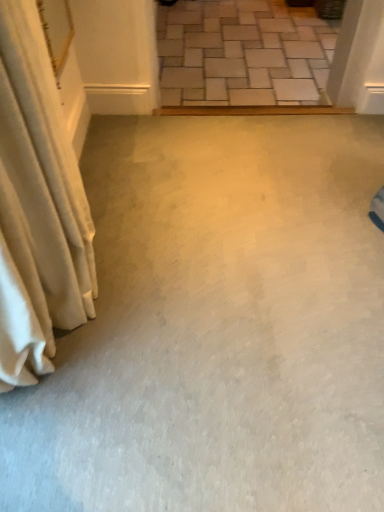
What do you see at coordinates (243, 53) in the screenshot?
I see `light gray stone steps at upper center` at bounding box center [243, 53].

You are a GUI agent. You are given a task and a screenshot of the screen. Output one action in this format:
    pyautogui.click(x=<x>, y=<y>)
    Task: Click on the light gray stone steps at upper center
    The width and height of the screenshot is (384, 512).
    Given the screenshot: What is the action you would take?
    pos(243,53)

Find the location of `white fabric curtain at left`. white fabric curtain at left is located at coordinates (37, 207).

Measure the distance between point (34, 5) and camera.

The distance of point (34, 5) from camera is 1.13 meters.

The image size is (384, 512). Describe the element at coordinates (37, 207) in the screenshot. I see `white fabric curtain at left` at that location.

You are a GUI agent. You are given a task and a screenshot of the screen. Output one action in this format:
    pyautogui.click(x=<x>, y=<y>)
    Task: Click on the light gray stone steps at upper center
    
    Given the screenshot: What is the action you would take?
    pyautogui.click(x=243, y=53)

Does white fabric curtain at left appear on the left side of light gray stone steps at upper center?

Indeed, white fabric curtain at left is positioned on the left side of light gray stone steps at upper center.

Considering the relative positions of white fabric curtain at left and light gray stone steps at upper center in the image provided, is white fabric curtain at left in front of light gray stone steps at upper center?

Yes.

Considering the points (14, 134) and (216, 1), which point is behind, point (14, 134) or point (216, 1)?

The point (216, 1) is behind.

From the image's perspective, which object appears higher, white fabric curtain at left or light gray stone steps at upper center?

light gray stone steps at upper center appears higher in the image.

From a real-world perspective, is white fabric curtain at left physically above light gray stone steps at upper center?

Indeed, from a real-world perspective, white fabric curtain at left stands above light gray stone steps at upper center.

Considering the sizes of white fabric curtain at left and light gray stone steps at upper center in the image, is white fabric curtain at left wider or thinner than light gray stone steps at upper center?

Considering their sizes, white fabric curtain at left looks slimmer than light gray stone steps at upper center.

Between white fabric curtain at left and light gray stone steps at upper center, which one has more height?

white fabric curtain at left is taller.

Who is bigger, white fabric curtain at left or light gray stone steps at upper center?

Bigger between the two is light gray stone steps at upper center.

Can we say white fabric curtain at left lies outside light gray stone steps at upper center?

That's correct, white fabric curtain at left is outside of light gray stone steps at upper center.

Are white fabric curtain at left and light gray stone steps at upper center making contact?

No, white fabric curtain at left is not next to light gray stone steps at upper center.

Is white fabric curtain at left facing towards light gray stone steps at upper center?

No, white fabric curtain at left is not aimed at light gray stone steps at upper center.

How far apart are white fabric curtain at left and light gray stone steps at upper center?

The distance of white fabric curtain at left from light gray stone steps at upper center is 2.51 meters.

Find the location of a particular element. concrete behind the white fabric curtain at left is located at coordinates (243, 53).

From the picture: Considering the positions of objects light gray stone steps at upper center and white fabric curtain at left in the image provided, who is more to the left, light gray stone steps at upper center or white fabric curtain at left?

white fabric curtain at left.

Is light gray stone steps at upper center positioned before white fabric curtain at left?

No.

Does point (250, 69) appear closer or farther from the camera than point (34, 47)?

Point (250, 69) is farther from the camera than point (34, 47).

From the image's perspective, does light gray stone steps at upper center appear lower than white fabric curtain at left?

No.

From a real-world perspective, does light gray stone steps at upper center stand above white fabric curtain at left?

No.

Looking at their sizes, would you say light gray stone steps at upper center is wider or thinner than white fabric curtain at left?

Considering their sizes, light gray stone steps at upper center looks broader than white fabric curtain at left.

Who is shorter, light gray stone steps at upper center or white fabric curtain at left?

With less height is light gray stone steps at upper center.

Which of these two, light gray stone steps at upper center or white fabric curtain at left, is bigger?

light gray stone steps at upper center is bigger.

Is light gray stone steps at upper center inside or outside of white fabric curtain at left?

The correct answer is: outside.

Is light gray stone steps at upper center positioned far away from white fabric curtain at left?

Absolutely, light gray stone steps at upper center is distant from white fabric curtain at left.

Is light gray stone steps at upper center looking in the opposite direction of white fabric curtain at left?

That's not correct — light gray stone steps at upper center is not looking away from white fabric curtain at left.

How distant is light gray stone steps at upper center from white fabric curtain at left?

They are 8.23 feet apart.

You are a GUI agent. You are given a task and a screenshot of the screen. Output one action in this format:
    pyautogui.click(x=<x>, y=<y>)
    Task: Click on the concrete above the white fabric curtain at left (from the image's perspective)
    
    Given the screenshot: What is the action you would take?
    pyautogui.click(x=243, y=53)

The width and height of the screenshot is (384, 512). Identify the location of concrete that is on the right side of white fabric curtain at left. (243, 53).

I want to click on curtain located on the left of light gray stone steps at upper center, so click(37, 207).